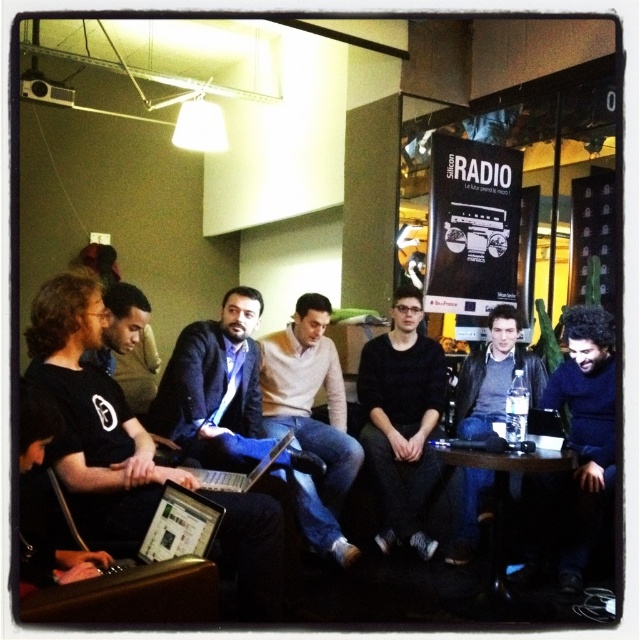
Question: Does light brown sweater at center have a smaller size compared to black plastic table at lower center?

Choices:
 (A) yes
 (B) no

Answer: (B)

Question: Can you confirm if black plastic table at lower center is smaller than silver metallic laptop at center?

Choices:
 (A) no
 (B) yes

Answer: (A)

Question: Estimate the real-world distances between objects in this image. Which object is farther from the matte black jacket at center?

Choices:
 (A) black matte sweater at center
 (B) silver metallic laptop at lower left

Answer: (B)

Question: Does silver metallic laptop at lower left appear under silver metallic laptop at center?

Choices:
 (A) no
 (B) yes

Answer: (B)

Question: Estimate the real-world distances between objects in this image. Which object is farther from the black plastic table at lower center?

Choices:
 (A) light brown sweater at center
 (B) silver metallic laptop at center

Answer: (B)

Question: Which point is farther from the camera taking this photo?

Choices:
 (A) coord(499,481)
 (B) coord(113,401)
 (C) coord(278,417)
 (D) coord(225,476)

Answer: (C)